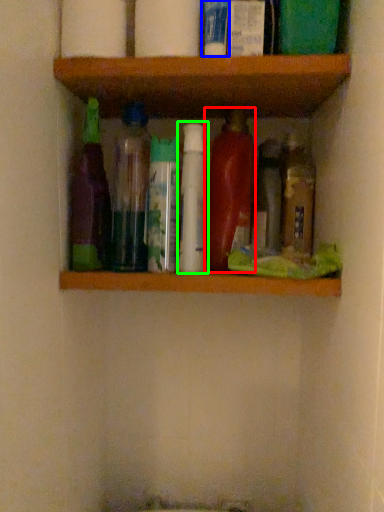
Question: Which object is the closest to the bottle (highlighted by a red box)? Choose among these: toiletry (highlighted by a blue box) or bottle (highlighted by a green box).

Choices:
 (A) toiletry
 (B) bottle

Answer: (B)